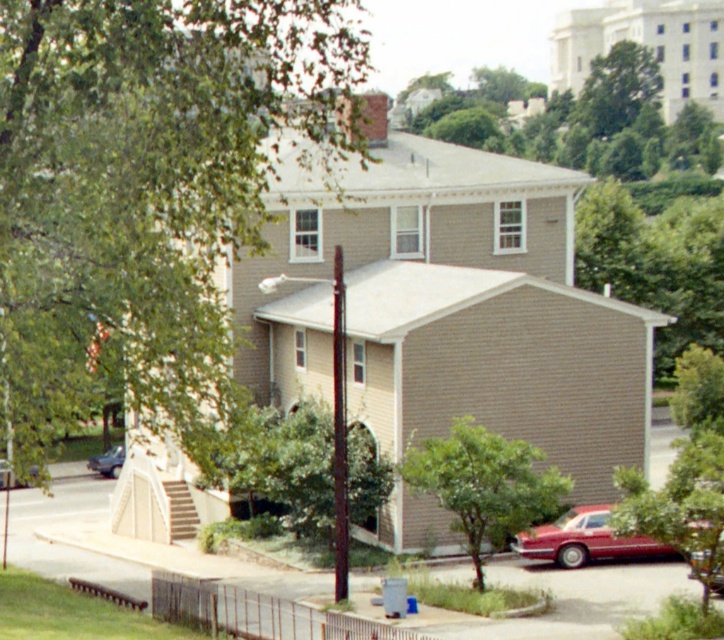
You are standing at the front gate of the two story residential building and want to walk to the metallic red car at lower right. There is a green leafy tree at lower right in your path. Can you walk around the tree to reach the car?

The green leafy tree at lower right is 49.59 feet away from the metallic red car at lower right. Since the distance between them is significant, you can easily walk around the tree to reach the car.

You are standing in front of the house and want to take a photo of the green leafy tree at upper center. Which direction should you face to ensure the tree is centered in your camera view?

To center the green leafy tree at upper center in your camera view, you should face the upper center direction, as that is where the tree is located according to its 2D coordinates at point [584,120].